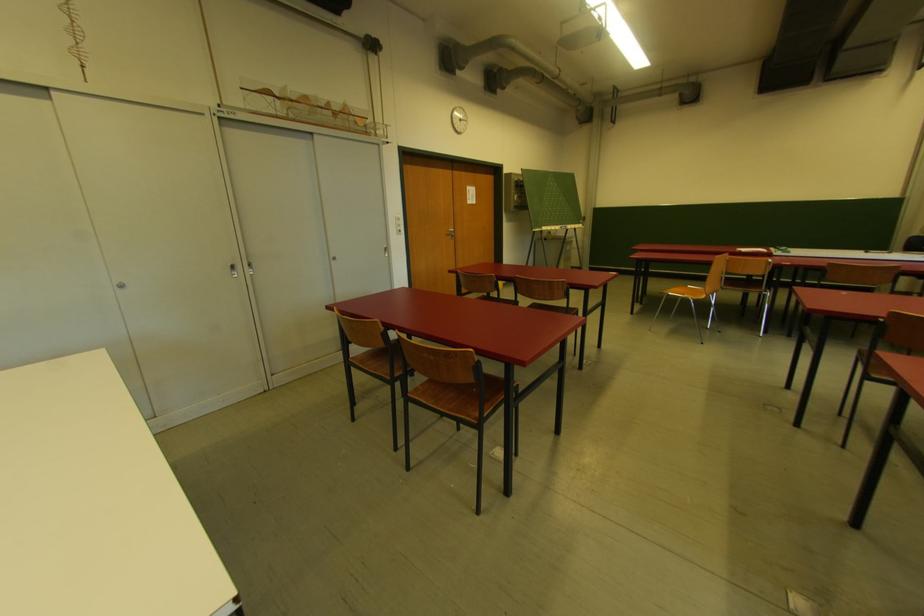
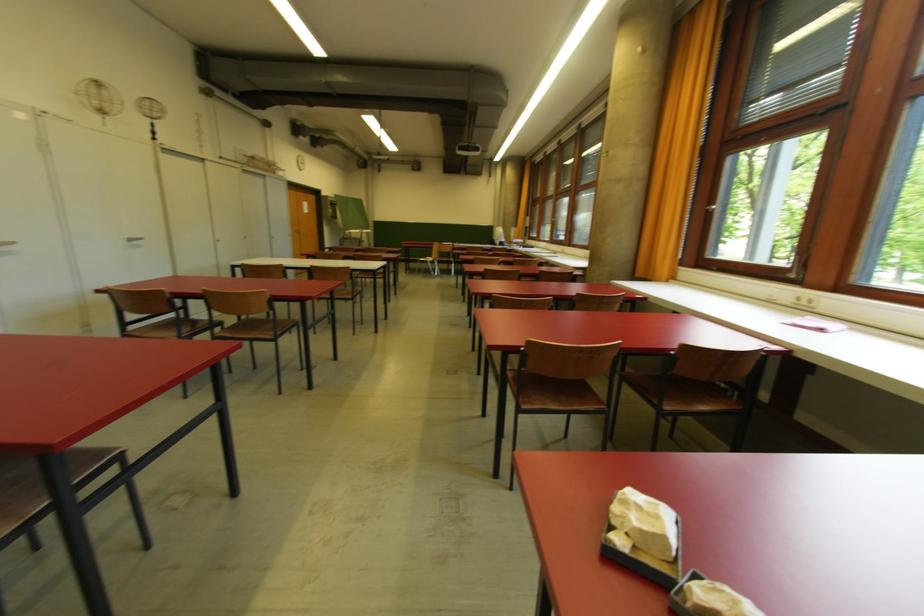
Locate, in the second image, the point that corresponds to the point at 124,288 in the first image.

(221, 243)